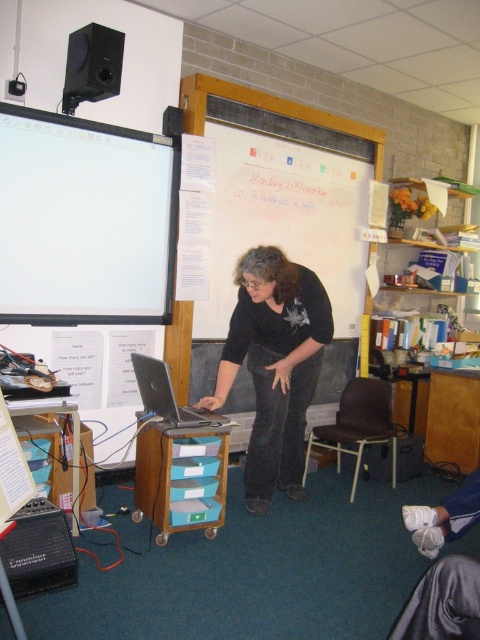
You are a student in the classroom and need to place the black matte speaker at upper left and the white fabric gloves at lower right into a storage box. Which object should you place first if the box has limited space and you want to maximize the number of items stored?

The black matte speaker at upper left has a smaller size compared to the white fabric gloves at lower right, so you should place the larger item first to maximize space efficiency. Therefore, put the white fabric gloves at lower right first.

You are a student in the classroom and need to write an equation on the board. Which object should you use, the whiteboard at upper center or the white fabric gloves at lower right?

The whiteboard at upper center is larger in size than the white fabric gloves at lower right, so you should use the whiteboard at upper center to write the equation.